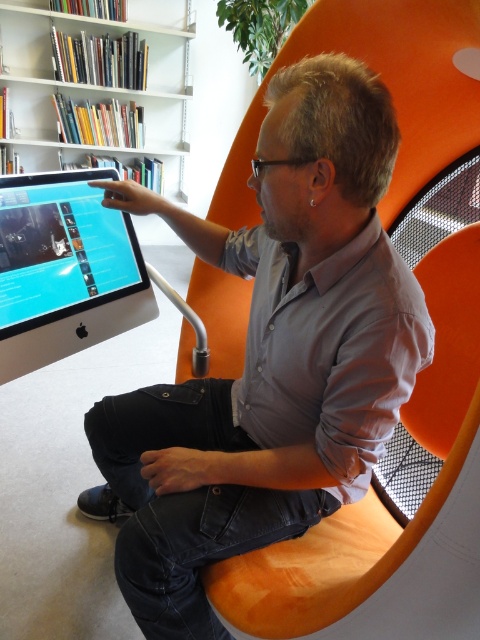
Question: Does orange wood swivel chair at center appear on the left side of matte black monitor at left?

Choices:
 (A) yes
 (B) no

Answer: (B)

Question: Which object is positioned farthest from the white glossy bookshelf at upper left?

Choices:
 (A) gray matte shirt at center
 (B) orange wood swivel chair at center
 (C) matte black monitor at left

Answer: (B)

Question: Can you confirm if gray matte shirt at center is positioned to the left of white glossy bookshelf at upper left?

Choices:
 (A) yes
 (B) no

Answer: (B)

Question: Is white glossy bookshelf at upper left bigger than matte black monitor at left?

Choices:
 (A) no
 (B) yes

Answer: (B)

Question: Which object is closer to the camera taking this photo?

Choices:
 (A) gray matte shirt at center
 (B) orange wood swivel chair at center
 (C) matte black monitor at left
 (D) white glossy bookshelf at upper left

Answer: (B)

Question: Based on their relative distances, which object is farther from the matte black monitor at left?

Choices:
 (A) gray matte shirt at center
 (B) orange wood swivel chair at center

Answer: (B)